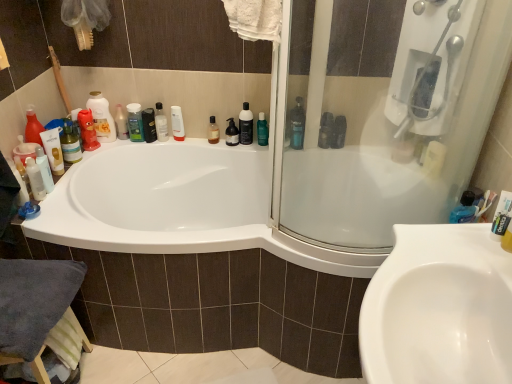
The width and height of the screenshot is (512, 384). What are the coordinates of `matte red bottle at left, acting as the 1th cleaning product starting from the left` in the screenshot? It's located at (87, 130).

Describe the element at coordinates (425, 71) in the screenshot. This screenshot has height=384, width=512. I see `white plastic shower at upper right` at that location.

What do you see at coordinates (262, 130) in the screenshot? The height and width of the screenshot is (384, 512). I see `green matte bottle at upper center, which is the first mouthwash from right to left` at bounding box center [262, 130].

What do you see at coordinates (135, 122) in the screenshot? This screenshot has width=512, height=384. I see `green matte shampoo at upper left, the second toiletry when ordered from right to left` at bounding box center [135, 122].

The width and height of the screenshot is (512, 384). What do you see at coordinates (246, 125) in the screenshot? I see `black glossy bottle at upper center, marked as the third mouthwash in a left-to-right arrangement` at bounding box center [246, 125].

The width and height of the screenshot is (512, 384). Identify the location of matte red bottle at left, the fourth cleaning product viewed from the right. (87, 130).

From a real-world perspective, is dark gray cotton towel at lower left located beneath green matte bottle at upper center, positioned as the fourth mouthwash in left-to-right order?

Correct, in the physical world, dark gray cotton towel at lower left is lower than green matte bottle at upper center, positioned as the fourth mouthwash in left-to-right order.

Identify the location of bath towel beneath the green matte bottle at upper center, positioned as the fourth mouthwash in left-to-right order (from a real-world perspective). The height and width of the screenshot is (384, 512). (34, 301).

From the picture: Would you say dark gray cotton towel at lower left contains green matte bottle at upper center, which is the first mouthwash from right to left?

No, green matte bottle at upper center, which is the first mouthwash from right to left, is not surrounded by dark gray cotton towel at lower left.

Is dark gray cotton towel at lower left aimed at green matte bottle at upper center, positioned as the fourth mouthwash in left-to-right order?

No, dark gray cotton towel at lower left is not oriented towards green matte bottle at upper center, positioned as the fourth mouthwash in left-to-right order.

Is blue glossy bottle at upper right, the 4th cleaning product positioned from the left, next to green matte bottle at upper center, which is the first mouthwash from right to left, and touching it?

No, blue glossy bottle at upper right, the 4th cleaning product positioned from the left, is not touching green matte bottle at upper center, which is the first mouthwash from right to left.

Is blue glossy bottle at upper right, the 4th cleaning product positioned from the left, oriented away from green matte bottle at upper center, which is the first mouthwash from right to left?

No, blue glossy bottle at upper right, the 4th cleaning product positioned from the left,'s orientation is not away from green matte bottle at upper center, which is the first mouthwash from right to left.

From a real-world perspective, is blue glossy bottle at upper right, the 4th cleaning product positioned from the left, below green matte bottle at upper center, which is the first mouthwash from right to left?

No, from a real-world perspective, blue glossy bottle at upper right, the 4th cleaning product positioned from the left, is not under green matte bottle at upper center, which is the first mouthwash from right to left.

Looking at this image, from the image's perspective, is blue glossy bottle at upper right, the 4th cleaning product positioned from the left, over green matte bottle at upper center, which is the first mouthwash from right to left?

→ Yes.

In terms of height, does matte white lotion at upper center, positioned as the 3th toiletry in right-to-left order, look taller or shorter compared to white glossy bottle at upper center, the 1th mouthwash from the left?

Considering their sizes, matte white lotion at upper center, positioned as the 3th toiletry in right-to-left order, has less height than white glossy bottle at upper center, the 1th mouthwash from the left.

From the image's perspective, is matte white lotion at upper center, which ranks as the first toiletry in left-to-right order, below white glossy bottle at upper center, which is the fourth mouthwash from right to left?

Incorrect, from the image's perspective, matte white lotion at upper center, which ranks as the first toiletry in left-to-right order, is higher than white glossy bottle at upper center, which is the fourth mouthwash from right to left.

In the scene shown: Would you say matte white lotion at upper center, which ranks as the first toiletry in left-to-right order, is outside white glossy bottle at upper center, which is the fourth mouthwash from right to left?

Absolutely, matte white lotion at upper center, which ranks as the first toiletry in left-to-right order, is external to white glossy bottle at upper center, which is the fourth mouthwash from right to left.

Considering the relative positions of matte white lotion at upper center, positioned as the 3th toiletry in right-to-left order, and white glossy bottle at upper center, which is the fourth mouthwash from right to left, in the image provided, is matte white lotion at upper center, positioned as the 3th toiletry in right-to-left order, in front of white glossy bottle at upper center, which is the fourth mouthwash from right to left,?

Yes, the depth of matte white lotion at upper center, positioned as the 3th toiletry in right-to-left order, is less than that of white glossy bottle at upper center, which is the fourth mouthwash from right to left.

Between translucent plastic bottle at upper left, which is the 2th cleaning product from left to right, and white matte toothpaste at right, which one has larger width?

translucent plastic bottle at upper left, which is the 2th cleaning product from left to right.

Locate an element on the screen. Image resolution: width=512 pixels, height=384 pixels. toothpaste on the right of translucent plastic bottle at upper left, which is the 2th cleaning product from left to right is located at coordinates (502, 216).

Is point (97, 102) positioned before point (507, 192)?

No, it is not.

Could you measure the distance between translucent plastic bottle at upper left, which is the 2th cleaning product from left to right, and white matte toothpaste at right?

They are 5.42 feet apart.

Can we say matte red bottle at left, acting as the 1th cleaning product starting from the left, lies outside translucent plastic bottle at upper left, which is the 2th cleaning product from left to right?

That's correct, matte red bottle at left, acting as the 1th cleaning product starting from the left, is outside of translucent plastic bottle at upper left, which is the 2th cleaning product from left to right.

Considering the relative sizes of matte red bottle at left, the fourth cleaning product viewed from the right, and translucent plastic bottle at upper left, which is the 2th cleaning product from left to right, in the image provided, is matte red bottle at left, the fourth cleaning product viewed from the right, taller than translucent plastic bottle at upper left, which is the 2th cleaning product from left to right,?

Incorrect, the height of matte red bottle at left, the fourth cleaning product viewed from the right, is not larger of that of translucent plastic bottle at upper left, which is the 2th cleaning product from left to right.

Would you consider matte red bottle at left, acting as the 1th cleaning product starting from the left, to be distant from translucent plastic bottle at upper left, which is the 2th cleaning product from left to right?

No.

Can you tell me how much translucent plastic bottle at upper center, placed as the 3th cleaning product when sorted from left to right, and brown glass bottle at upper center, which appears as the third mouthwash when viewed from the right, differ in facing direction?

5.37 degrees separate the facing orientations of translucent plastic bottle at upper center, placed as the 3th cleaning product when sorted from left to right, and brown glass bottle at upper center, which appears as the third mouthwash when viewed from the right.

Does translucent plastic bottle at upper center, placed as the 3th cleaning product when sorted from left to right, appear on the right side of brown glass bottle at upper center, the second mouthwash positioned from the left?

Incorrect, translucent plastic bottle at upper center, placed as the 3th cleaning product when sorted from left to right, is not on the right side of brown glass bottle at upper center, the second mouthwash positioned from the left.

In the scene shown: Does translucent plastic bottle at upper center, placed as the 3th cleaning product when sorted from left to right, have a lesser width compared to brown glass bottle at upper center, the second mouthwash positioned from the left?

No, translucent plastic bottle at upper center, placed as the 3th cleaning product when sorted from left to right, is not thinner than brown glass bottle at upper center, the second mouthwash positioned from the left.

From their relative heights in the image, would you say translucent plastic bottle at upper center, placed as the 3th cleaning product when sorted from left to right, is taller or shorter than brown glass bottle at upper center, the second mouthwash positioned from the left?

translucent plastic bottle at upper center, placed as the 3th cleaning product when sorted from left to right, is taller than brown glass bottle at upper center, the second mouthwash positioned from the left.

Is white glossy sink at lower right a part of white plastic shower at upper right?

No, white glossy sink at lower right is not a part of white plastic shower at upper right.

Can you confirm if white plastic shower at upper right is wider than white glossy sink at lower right?

In fact, white plastic shower at upper right might be narrower than white glossy sink at lower right.

From a real-world perspective, between white plastic shower at upper right and white glossy sink at lower right, who is vertically higher?

white plastic shower at upper right.

Is point (424, 73) more distant than point (414, 352)?

Yes, it is behind point (414, 352).

Identify the location of bath towel in front of the green matte bottle at upper center, which is the first mouthwash from right to left. (34, 301).

This screenshot has height=384, width=512. Find the location of `the 3rd cleaning product directly above the green matte bottle at upper center, which is the first mouthwash from right to left (from a real-world perspective)`. the 3rd cleaning product directly above the green matte bottle at upper center, which is the first mouthwash from right to left (from a real-world perspective) is located at coordinates (297, 125).

From the image, which object appears to be nearer to white glossy sink at lower right, brown glass bottle at upper center, which appears as the third mouthwash when viewed from the right, or translucent plastic bottle at upper center, placed as the 3th cleaning product when sorted from left to right?

Based on the image, brown glass bottle at upper center, which appears as the third mouthwash when viewed from the right, appears to be nearer to white glossy sink at lower right.

Based on their spatial positions, is matte red bottle at left, the fourth cleaning product viewed from the right, or green matte shampoo at upper left, the second toiletry when ordered from right to left, further from blue glossy bottle at upper right, positioned as the first cleaning product in right-to-left order?

matte red bottle at left, the fourth cleaning product viewed from the right, lies further to blue glossy bottle at upper right, positioned as the first cleaning product in right-to-left order, than the other object.

Based on their spatial positions, is matte red bottle at left, the fourth cleaning product viewed from the right, or white glossy bottle at upper center, the 1th mouthwash from the left, further from blue glossy bottle at upper right, the 4th cleaning product positioned from the left?

Among the two, matte red bottle at left, the fourth cleaning product viewed from the right, is located further to blue glossy bottle at upper right, the 4th cleaning product positioned from the left.

From the image, which object appears to be nearer to white glossy sink at lower right, black glossy bottle at upper center, marked as the third mouthwash in a left-to-right arrangement, or translucent plastic bottle at upper left, which is the 2th cleaning product from left to right?

black glossy bottle at upper center, marked as the third mouthwash in a left-to-right arrangement.

When comparing their distances from green matte shampoo at upper left, the second toiletry when ordered from right to left, does white plastic shower at upper right or black pump bottle at upper center, which ranks as the 1th toiletry in right-to-left order, seem further?

white plastic shower at upper right.

Looking at the image, which one is located closer to brown glass bottle at upper center, which appears as the third mouthwash when viewed from the right, white glossy bottle at upper center, which is the fourth mouthwash from right to left, or green matte shampoo at upper left, the second toiletry when ordered from right to left?

white glossy bottle at upper center, which is the fourth mouthwash from right to left, is closer to brown glass bottle at upper center, which appears as the third mouthwash when viewed from the right.

Considering their positions, is matte red bottle at left, the fourth cleaning product viewed from the right, positioned further to black pump bottle at upper center, which ranks as the 1th toiletry in right-to-left order, than white glossy sink at lower right?

Among the two, white glossy sink at lower right is located further to black pump bottle at upper center, which ranks as the 1th toiletry in right-to-left order.

Based on their spatial positions, is white glossy sink at lower right or green matte bottle at upper center, positioned as the fourth mouthwash in left-to-right order, further from white glossy bottle at upper center, which is the fourth mouthwash from right to left?

white glossy sink at lower right is positioned further to the anchor white glossy bottle at upper center, which is the fourth mouthwash from right to left.

The height and width of the screenshot is (384, 512). Identify the location of cleaning product between green matte shampoo at upper left, the 2th toiletry positioned from the left, and green matte bottle at upper center, positioned as the fourth mouthwash in left-to-right order, from left to right. (161, 123).

This screenshot has width=512, height=384. I want to click on sink situated between translucent plastic bottle at upper center, placed as the 3th cleaning product when sorted from left to right, and white plastic shower at upper right from left to right, so click(439, 309).

Identify the location of mouthwash between black glossy bottle at upper center, the 2th mouthwash from the right, and blue glossy bottle at upper right, positioned as the first cleaning product in right-to-left order. (262, 130).

I want to click on sink located between matte red bottle at left, the fourth cleaning product viewed from the right, and white matte toothpaste at right in the left-right direction, so click(x=439, y=309).